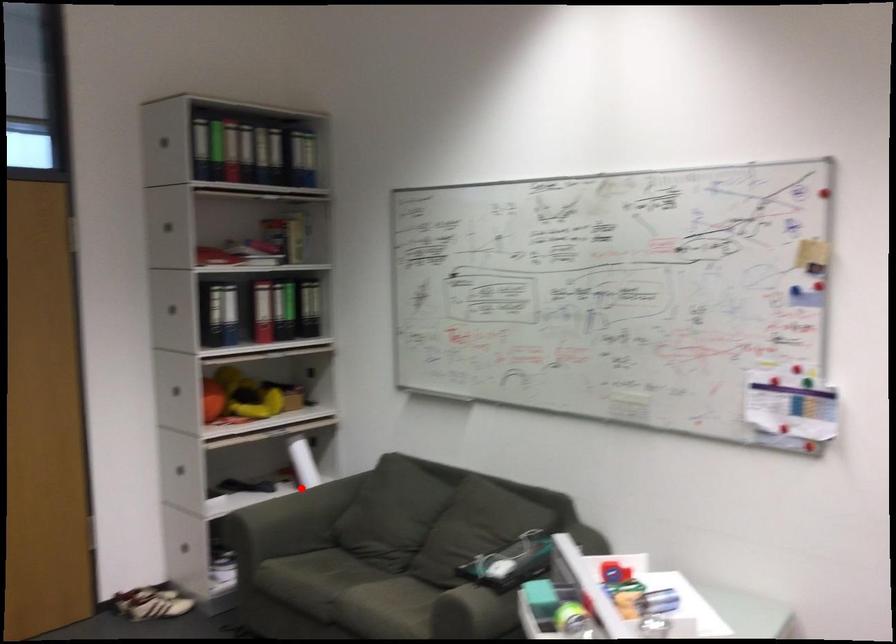
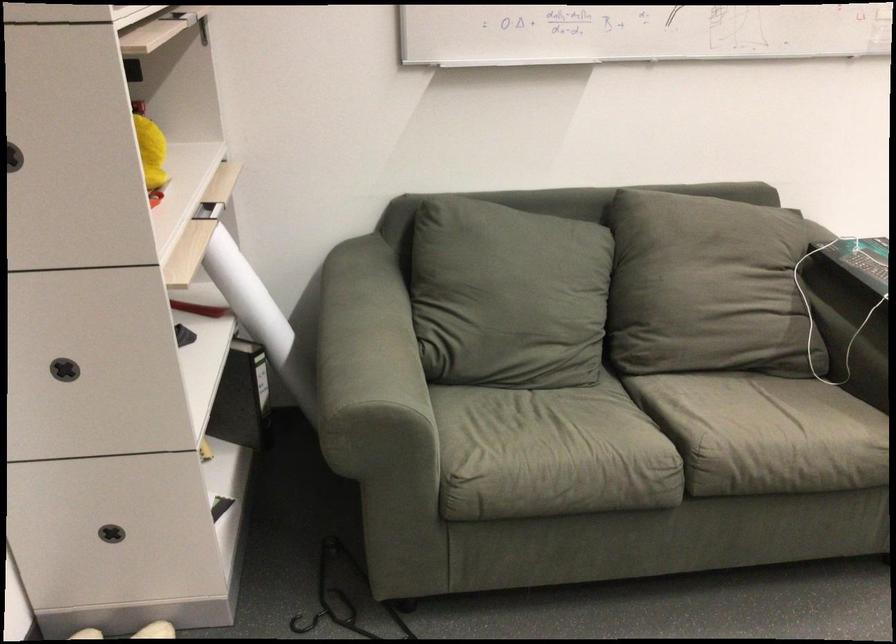
Question: I am providing you with two images of the same scene from different viewpoints. Image1 has a red point marked. In image2, the corresponding 3D location appears at what relative position? Reply with the corresponding letter.

Choices:
 (A) Closer
 (B) Farther

Answer: (A)